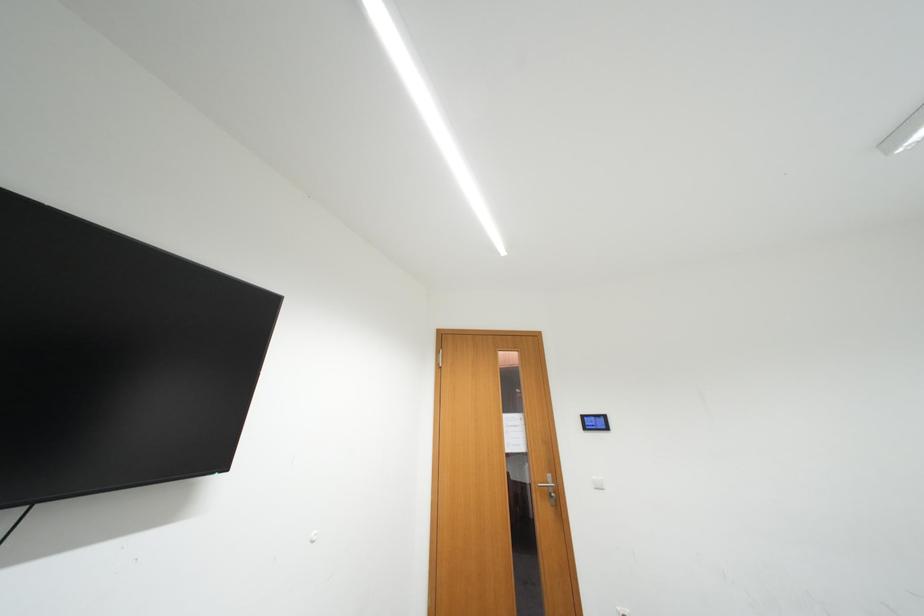
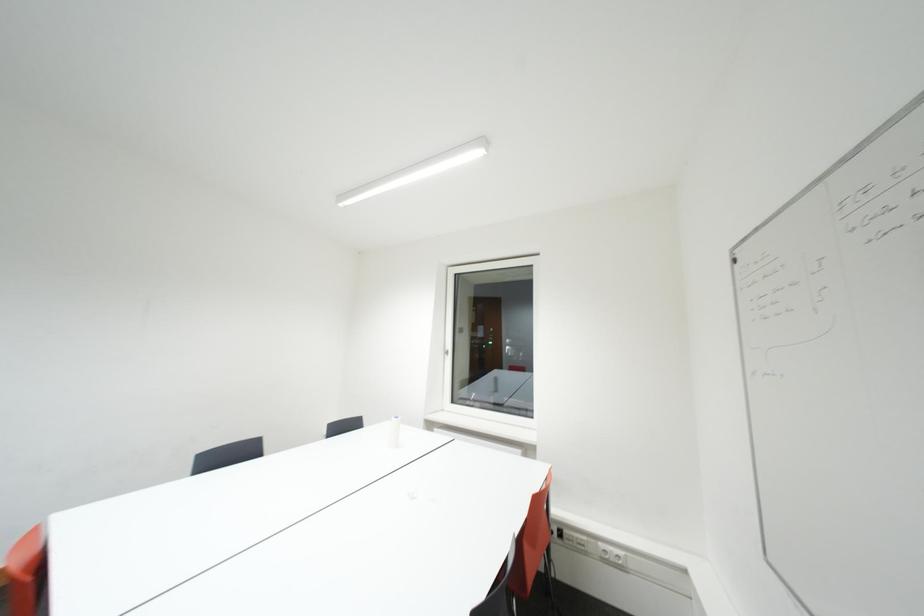
Question: The images are taken continuously from a first-person perspective. In which direction is your viewpoint rotating?

Choices:
 (A) Left
 (B) Right
 (C) Up
 (D) Down

Answer: (B)